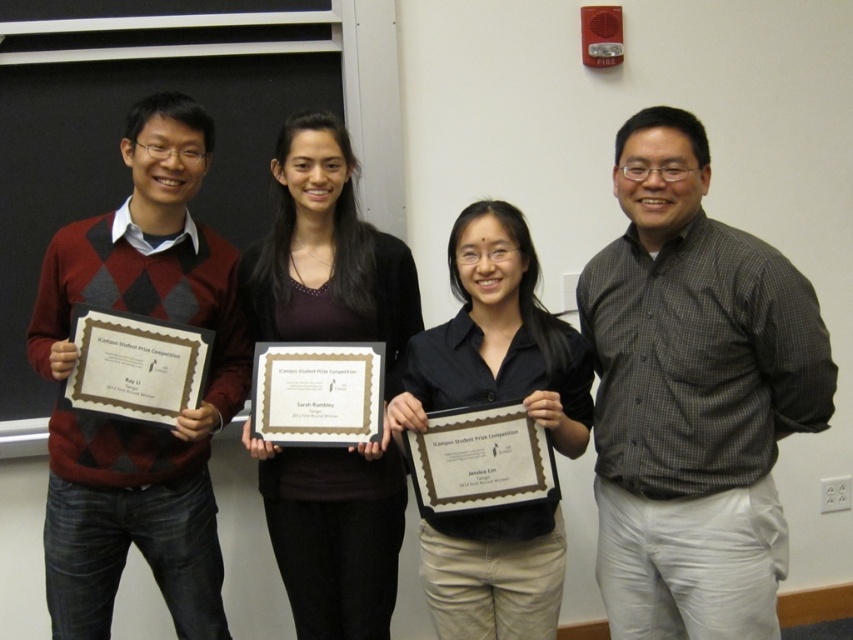
You are standing in the room where the certificate ceremony is taking place. There are two points marked on the floor at coordinates point (675, 627) and point (206, 323). If you want to move closer to the certificates held by the people, which point should you walk towards?

You should walk towards point (675, 627) because it is closer to the viewer, meaning it is nearer to where the certificates are held by the individuals in the scene.

You are standing in the room where the certificate ceremony is taking place. There are two points marked in the scene. The first point is at coordinates point (749, 356) and the second is at point (332, 372). Which of these two points is closer to you?

Point (749, 356) is closer to the viewer than point (332, 372).